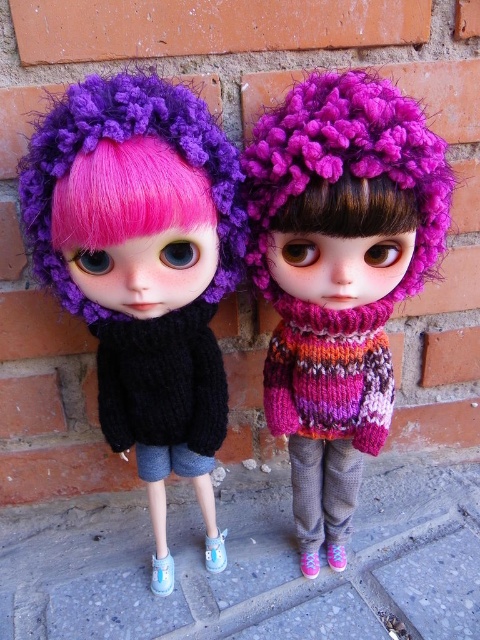
Question: Is purple knitted hat at left positioned in front of knitted multicolor sweater at center?

Choices:
 (A) no
 (B) yes

Answer: (B)

Question: Which of the following is the farthest from the observer?

Choices:
 (A) knitted multicolor sweater at center
 (B) purple knitted hat at left
 (C) fuzzy pink hair at center

Answer: (A)

Question: Among these points, which one is nearest to the camera?

Choices:
 (A) (26, 225)
 (B) (368, 179)
 (C) (408, 156)
 (D) (204, 330)

Answer: (B)

Question: Which of the following is the closest to the observer?

Choices:
 (A) purple knitted hat at left
 (B) black knitted sweater at center
 (C) knitted multicolor sweater at center
 (D) matte black sweater at left

Answer: (D)

Question: Is matte black sweater at left smaller than purple knitted hat at upper center?

Choices:
 (A) yes
 (B) no

Answer: (B)

Question: Does purple knitted hat at left appear under black knitted sweater at center?

Choices:
 (A) yes
 (B) no

Answer: (B)